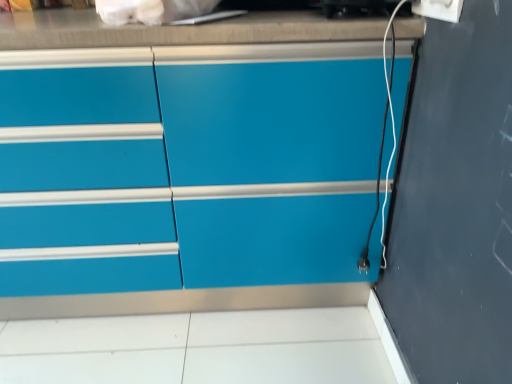
Question: Can you confirm if white plastic electric outlet at upper right is bigger than matte blue cabinet at center?

Choices:
 (A) yes
 (B) no

Answer: (B)

Question: Would you say white plastic electric outlet at upper right is a long distance from matte blue cabinet at center?

Choices:
 (A) yes
 (B) no

Answer: (B)

Question: Could you tell me if white plastic electric outlet at upper right is facing matte blue cabinet at center?

Choices:
 (A) yes
 (B) no

Answer: (B)

Question: Is white plastic electric outlet at upper right completely or partially outside of matte blue cabinet at center?

Choices:
 (A) yes
 (B) no

Answer: (A)

Question: Does white plastic electric outlet at upper right have a smaller size compared to matte blue cabinet at center?

Choices:
 (A) yes
 (B) no

Answer: (A)

Question: From a real-world perspective, is white plastic electric outlet at upper right over matte blue cabinet at center?

Choices:
 (A) no
 (B) yes

Answer: (B)

Question: Can you confirm if matte blue cabinet at center is smaller than white plastic electric outlet at upper right?

Choices:
 (A) no
 (B) yes

Answer: (A)

Question: Is matte blue cabinet at center next to white plastic electric outlet at upper right?

Choices:
 (A) yes
 (B) no

Answer: (B)

Question: Is matte blue cabinet at center not within white plastic electric outlet at upper right?

Choices:
 (A) yes
 (B) no

Answer: (A)

Question: From the image's perspective, is matte blue cabinet at center under white plastic electric outlet at upper right?

Choices:
 (A) no
 (B) yes

Answer: (B)

Question: Considering the relative sizes of matte blue cabinet at center and white plastic electric outlet at upper right in the image provided, is matte blue cabinet at center bigger than white plastic electric outlet at upper right?

Choices:
 (A) no
 (B) yes

Answer: (B)

Question: From a real-world perspective, is matte blue cabinet at center positioned over white plastic electric outlet at upper right based on gravity?

Choices:
 (A) no
 (B) yes

Answer: (A)

Question: Is point (452, 9) closer or farther from the camera than point (181, 304)?

Choices:
 (A) farther
 (B) closer

Answer: (B)